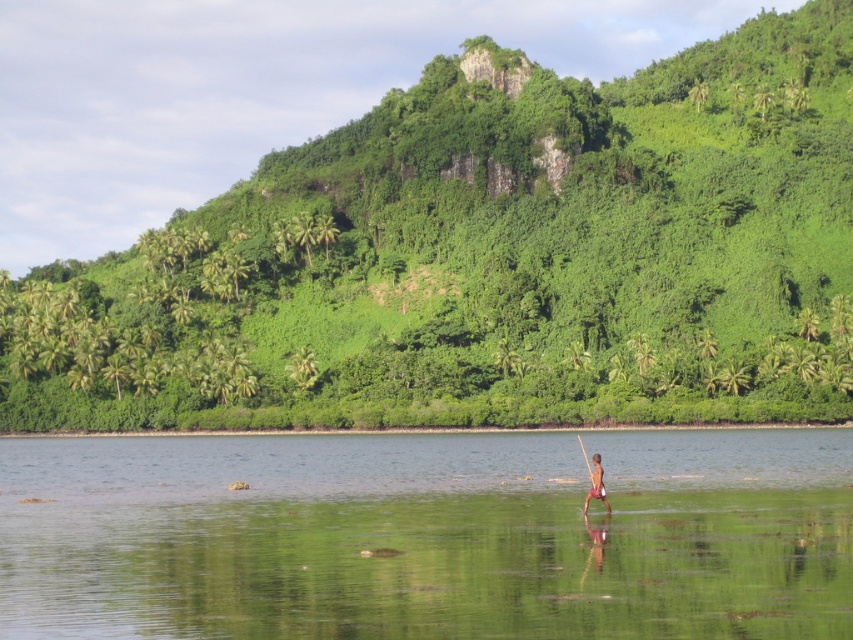
Question: Can you confirm if green leafy hillside at upper center is positioned below brown skin at center?

Choices:
 (A) no
 (B) yes

Answer: (A)

Question: Is clear water at center below brown skin at center?

Choices:
 (A) no
 (B) yes

Answer: (B)

Question: Which object appears farthest from the camera in this image?

Choices:
 (A) clear water at center
 (B) brown skin at center

Answer: (B)

Question: Which point is closer to the camera?

Choices:
 (A) brown skin at center
 (B) clear water at center
 (C) green leafy hillside at upper center

Answer: (B)

Question: Is green leafy hillside at upper center above brown skin at center?

Choices:
 (A) yes
 (B) no

Answer: (A)

Question: Which object is closer to the camera taking this photo?

Choices:
 (A) green leafy hillside at upper center
 (B) brown skin at center

Answer: (B)